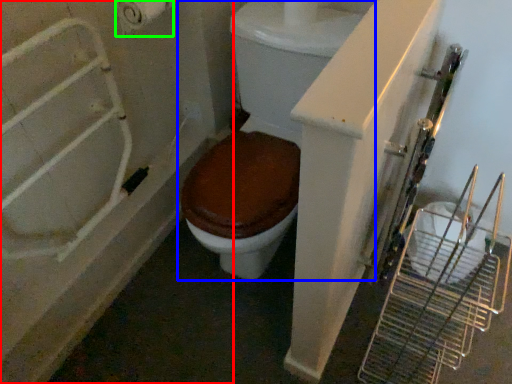
Question: Estimate the real-world distances between objects in this image. Which object is farther from bath (highlighted by a red box), toilet (highlighted by a blue box) or toilet paper (highlighted by a green box)?

Choices:
 (A) toilet
 (B) toilet paper

Answer: (B)